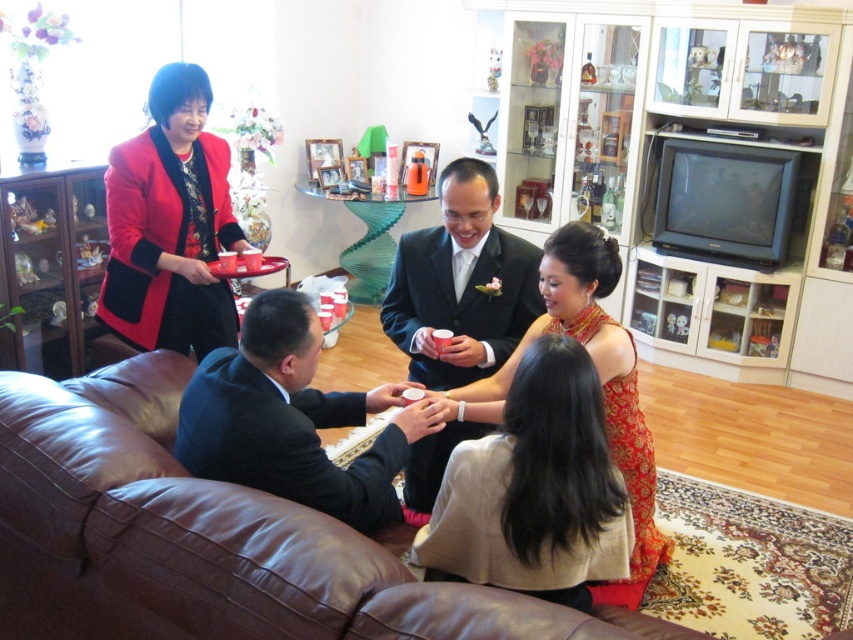
You are planning to rearrange the living room furniture. If you want to place a new coffee table between the brown leather couch at lower left and the dark blue suit at center, will the couch be wider than the suit?

The brown leather couch at lower left is larger in size than dark blue suit at center, so yes, the couch will be wider than the suit when placing the coffee table between them.

You are a photographer setting up for a group photo. You need to position the matte red blazer at left and the silk red dress at center so that both are visible in the frame. Considering their heights, which one should you adjust to ensure both are fully visible?

The matte red blazer at left is shorter than the silk red dress at center. To ensure both are fully visible, you should lower the camera angle slightly so that the shorter matte red blazer at left is not obscured by the taller silk red dress at center.

You are standing in the living room and want to place a small table between the dark blue suit at center and the shiny black suit at center. Based on their positions, where should you place the table?

The dark blue suit at center is located below the shiny black suit at center, so you should place the table between them vertically, positioning it below the shiny black suit at center and above the dark blue suit at center to ensure it is between both suits.